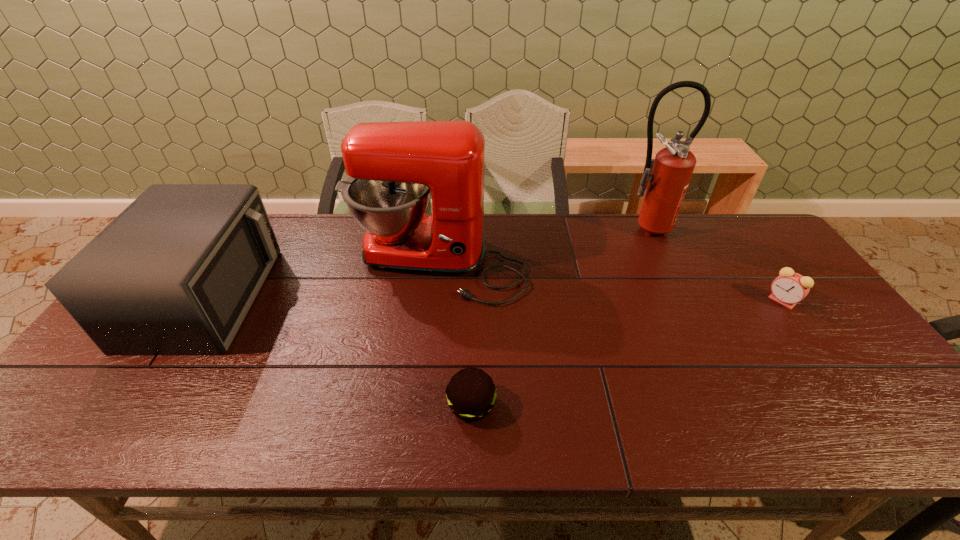
This screenshot has width=960, height=540. I want to click on free spot between the leftmost object and the nearest object, so click(339, 351).

Find the location of `free space between the fire extinguisher and the alarm clock`. free space between the fire extinguisher and the alarm clock is located at coordinates coord(713,265).

At what (x,y) coordinates should I click in order to perform the action: click on vacant area that lies between the tallest object and the patty. Please return your answer as a coordinate pair (x, y). The height and width of the screenshot is (540, 960). Looking at the image, I should click on (558, 317).

You are a GUI agent. You are given a task and a screenshot of the screen. Output one action in this format:
    pyautogui.click(x=<x>, y=<y>)
    Task: Click on the empty space between the alarm clock and the leftmost object
    Image resolution: width=960 pixels, height=540 pixels.
    Given the screenshot: What is the action you would take?
    pyautogui.click(x=494, y=299)

Where is `vacant space that's between the third tallest object and the nearest object`? The height and width of the screenshot is (540, 960). vacant space that's between the third tallest object and the nearest object is located at coordinates (339, 351).

Point out which object is positioned as the third nearest to the fourth shortest object. Please provide its 2D coordinates. Your answer should be formatted as a tuple, i.e. [(x, y)], where the tuple contains the x and y coordinates of a point satisfying the conditions above.

[(670, 172)]

You are a GUI agent. You are given a task and a screenshot of the screen. Output one action in this format:
    pyautogui.click(x=<x>, y=<y>)
    Task: Click on the object that ranks as the fourth closest to the fourth shortest object
    The image size is (960, 540).
    Given the screenshot: What is the action you would take?
    pyautogui.click(x=789, y=288)

The image size is (960, 540). In order to click on free space that satisfies the following two spatial constraints: 1. on the face of the alarm clock; 2. on the front side of the patty in this screenshot , I will do `click(857, 406)`.

Locate an element on the screen. vacant position in the image that satisfies the following two spatial constraints: 1. on the front-facing side of the kitchen mixer; 2. on the front-facing side of the microwave oven is located at coordinates click(x=434, y=297).

Identify the location of vacant space that satisfies the following two spatial constraints: 1. on the front-facing side of the kitchen mixer; 2. on the front-facing side of the microwave oven. (434, 297).